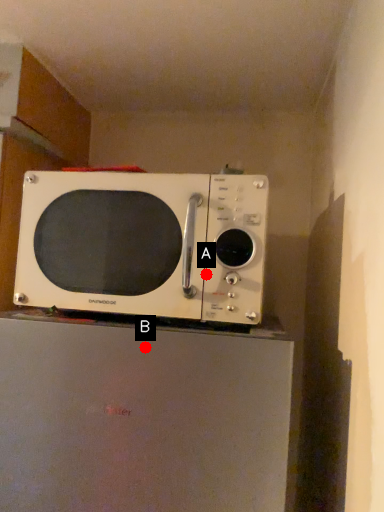
Question: Two points are circled on the image, labeled by A and B beside each circle. Which of the following is the farthest from the observer?

Choices:
 (A) A is further
 (B) B is further

Answer: (A)